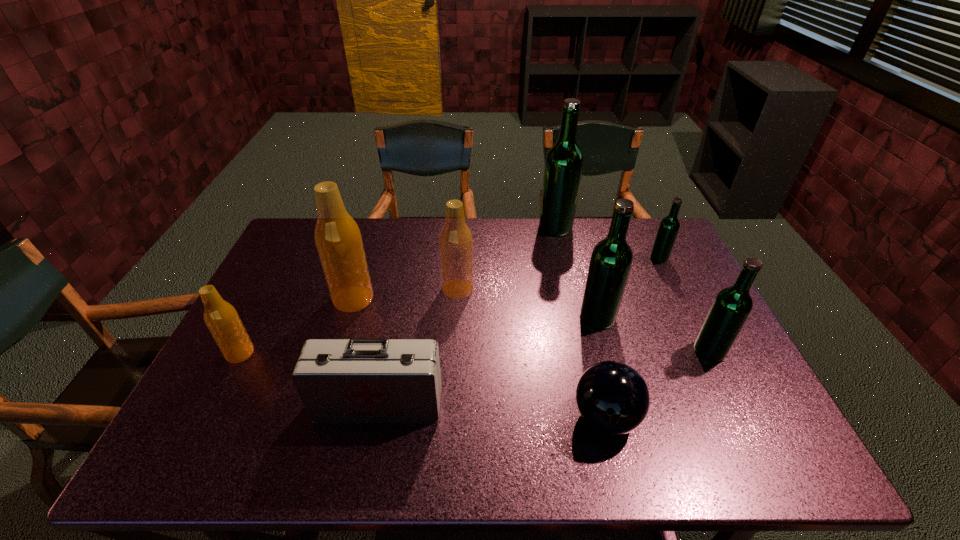
In the image, there is a desktop. Where is `blank space at the right edge`? This screenshot has height=540, width=960. blank space at the right edge is located at coordinates (653, 304).

In the image, there is a desktop. What are the coordinates of `vacant area at the near left corner` in the screenshot? It's located at (202, 439).

Where is `vacant space at the near right corner`? vacant space at the near right corner is located at coordinates (748, 442).

At what (x,y) coordinates should I click in order to perform the action: click on free space between the third biggest green beer bottle and the nearest tan beer bottle. Please return your answer as a coordinate pair (x, y). This screenshot has height=540, width=960. Looking at the image, I should click on (475, 352).

This screenshot has height=540, width=960. What are the coordinates of `empty location between the third farthest green beer bottle and the second farthest green beer bottle` in the screenshot? It's located at (628, 288).

Identify the location of vacant point located between the black bowling ball and the farthest green beer bottle. (581, 322).

I want to click on free spot between the leftmost tan beer bottle and the fifth beer bottle from right to left, so click(x=349, y=321).

This screenshot has width=960, height=540. I want to click on free area in between the second shortest object and the third farthest green beer bottle, so click(x=488, y=360).

What are the coordinates of `unoccupied position between the farthest object and the nearest green beer bottle` in the screenshot? It's located at (633, 289).

At what (x,y) coordinates should I click in order to perform the action: click on free spot between the third smallest green beer bottle and the first-aid kit. Please return your answer as a coordinate pair (x, y). The height and width of the screenshot is (540, 960). Looking at the image, I should click on (488, 360).